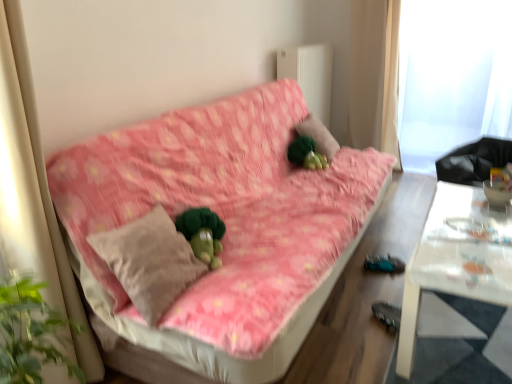
Question: Is green plush at center touching transparent plastic window screen at upper right?

Choices:
 (A) no
 (B) yes

Answer: (A)

Question: Does green plush at center have a greater width compared to transparent plastic window screen at upper right?

Choices:
 (A) no
 (B) yes

Answer: (A)

Question: Is transparent plastic window screen at upper right inside green plush at center?

Choices:
 (A) no
 (B) yes

Answer: (A)

Question: Can you confirm if green plush at center is shorter than transparent plastic window screen at upper right?

Choices:
 (A) yes
 (B) no

Answer: (A)

Question: Does green plush at center appear on the left side of transparent plastic window screen at upper right?

Choices:
 (A) yes
 (B) no

Answer: (A)

Question: Visually, is white fabric curtain at upper right positioned to the left or to the right of green plush at center?

Choices:
 (A) left
 (B) right

Answer: (B)

Question: From the image's perspective, is white fabric curtain at upper right positioned above or below green plush at center?

Choices:
 (A) below
 (B) above

Answer: (B)

Question: From a real-world perspective, relative to green plush at center, is white fabric curtain at upper right vertically above or below?

Choices:
 (A) below
 (B) above

Answer: (B)

Question: In terms of width, does white fabric curtain at upper right look wider or thinner when compared to green plush at center?

Choices:
 (A) wide
 (B) thin

Answer: (A)

Question: Is green plush at center bigger or smaller than transparent plastic window screen at upper right?

Choices:
 (A) big
 (B) small

Answer: (B)

Question: From the image's perspective, is green plush at center above or below transparent plastic window screen at upper right?

Choices:
 (A) above
 (B) below

Answer: (B)

Question: Does point (312, 114) appear closer or farther from the camera than point (438, 71)?

Choices:
 (A) closer
 (B) farther

Answer: (A)

Question: Is green plush at center spatially inside transparent plastic window screen at upper right, or outside of it?

Choices:
 (A) outside
 (B) inside

Answer: (A)

Question: From a real-world perspective, is white glossy table at right physically located above or below beige fabric pillow at center?

Choices:
 (A) above
 (B) below

Answer: (B)

Question: Looking at their shapes, would you say white glossy table at right is wider or thinner than beige fabric pillow at center?

Choices:
 (A) wide
 (B) thin

Answer: (A)